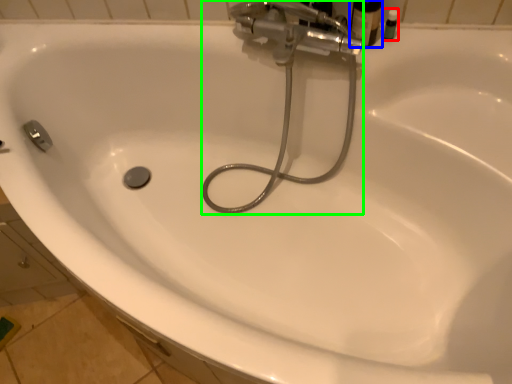
Question: Which object is positioned farthest from toiletry (highlighted by a red box)? Select from toiletry (highlighted by a blue box) and plumbing fixture (highlighted by a green box).

Choices:
 (A) toiletry
 (B) plumbing fixture

Answer: (B)